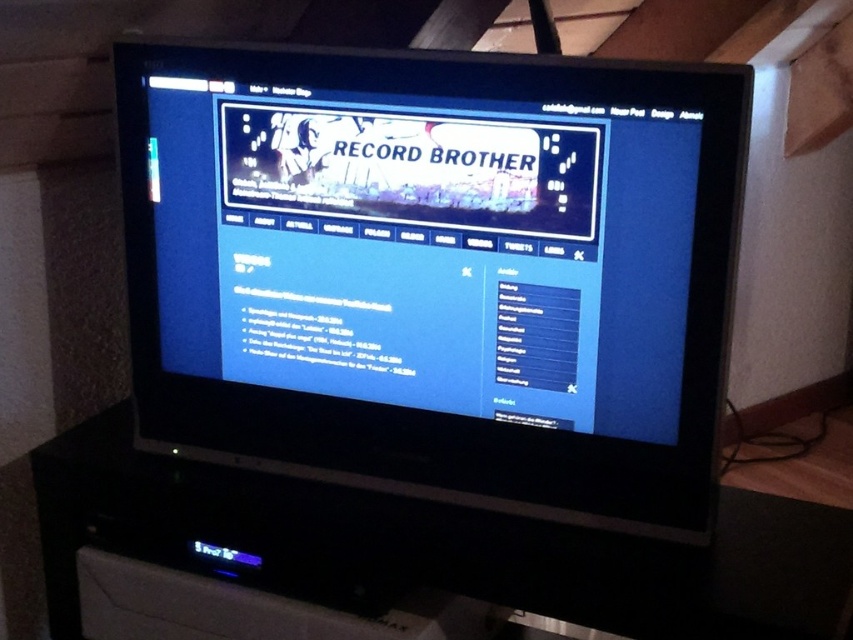
Question: Can you confirm if black glossy monitor at center is wider than black plastic entertainment center at center?

Choices:
 (A) yes
 (B) no

Answer: (B)

Question: Which of the following is the farthest from the observer?

Choices:
 (A) (697, 262)
 (B) (213, 577)

Answer: (B)

Question: Which object is farther from the camera taking this photo?

Choices:
 (A) black glossy monitor at center
 (B) black plastic entertainment center at center

Answer: (A)

Question: Which of the following is the farthest from the observer?

Choices:
 (A) (599, 564)
 (B) (247, 76)

Answer: (B)

Question: Does black glossy monitor at center appear under black plastic entertainment center at center?

Choices:
 (A) no
 (B) yes

Answer: (A)

Question: Is black glossy monitor at center thinner than black plastic entertainment center at center?

Choices:
 (A) no
 (B) yes

Answer: (B)